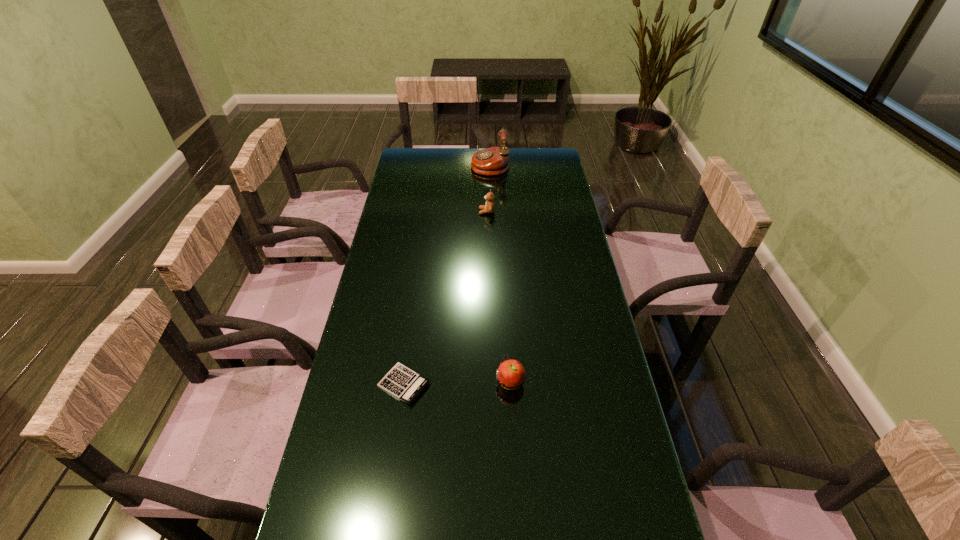
Locate an element on the screen. The width and height of the screenshot is (960, 540). the farthest object is located at coordinates (492, 161).

This screenshot has height=540, width=960. Identify the location of telephone. (492, 161).

In order to click on teddy bear in this screenshot , I will do `click(489, 207)`.

The height and width of the screenshot is (540, 960). Find the location of `apple`. apple is located at coordinates (510, 374).

Locate an element on the screen. the leftmost object is located at coordinates (403, 383).

Where is `calculator`? The height and width of the screenshot is (540, 960). calculator is located at coordinates (403, 383).

Find the location of `vacant space located on the dial of the farthest object`. vacant space located on the dial of the farthest object is located at coordinates (437, 164).

This screenshot has height=540, width=960. I want to click on vacant space situated on the dial of the farthest object, so click(x=437, y=164).

Identify the location of free point located on the dial of the farthest object. (452, 164).

Locate an element on the screen. free location located on the front-facing side of the teddy bear is located at coordinates (398, 212).